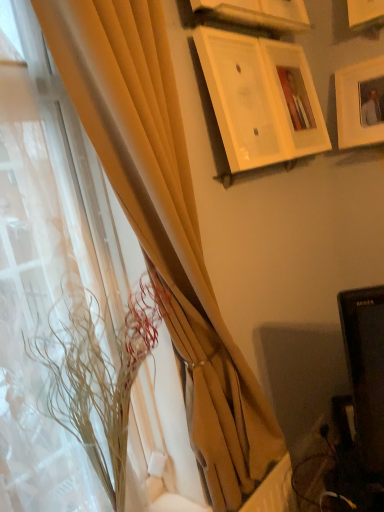
Question: Which direction should I rotate to look at wooden picture frame at upper center, the 3th picture frame in the right-to-left sequence, — up or down?

Choices:
 (A) up
 (B) down

Answer: (A)

Question: Is white matte picture frame at upper right, which is the first picture frame from right to left, to the right of matte yellow curtain at left, arranged as the first curtain when viewed from the right, from the viewer's perspective?

Choices:
 (A) yes
 (B) no

Answer: (A)

Question: Is white matte picture frame at upper right, the fourth picture frame in the left-to-right sequence, smaller than matte yellow curtain at left, the second curtain in the left-to-right sequence?

Choices:
 (A) no
 (B) yes

Answer: (B)

Question: Is white matte picture frame at upper right, which is the first picture frame from right to left, wider than matte yellow curtain at left, the second curtain in the left-to-right sequence?

Choices:
 (A) no
 (B) yes

Answer: (A)

Question: Is white matte picture frame at upper right, which is the first picture frame from right to left, to the left of matte yellow curtain at left, arranged as the first curtain when viewed from the right, from the viewer's perspective?

Choices:
 (A) no
 (B) yes

Answer: (A)

Question: Is white matte picture frame at upper right, the fourth picture frame in the left-to-right sequence, facing away from matte yellow curtain at left, the second curtain in the left-to-right sequence?

Choices:
 (A) no
 (B) yes

Answer: (A)

Question: Is white matte picture frame at upper right, the fourth picture frame in the left-to-right sequence, taller than matte yellow curtain at left, the second curtain in the left-to-right sequence?

Choices:
 (A) no
 (B) yes

Answer: (A)

Question: Is wooden picture frame at upper center, the second picture frame when ordered from left to right, to the right of wooden picture frame at upper center, which is counted as the 2th picture frame, starting from the right, from the viewer's perspective?

Choices:
 (A) yes
 (B) no

Answer: (B)

Question: Does wooden picture frame at upper center, the 3th picture frame in the right-to-left sequence, touch wooden picture frame at upper center, which is the 3th picture frame in left-to-right order?

Choices:
 (A) no
 (B) yes

Answer: (A)

Question: Considering the relative sizes of wooden picture frame at upper center, the 3th picture frame in the right-to-left sequence, and wooden picture frame at upper center, which is counted as the 2th picture frame, starting from the right, in the image provided, is wooden picture frame at upper center, the 3th picture frame in the right-to-left sequence, smaller than wooden picture frame at upper center, which is counted as the 2th picture frame, starting from the right,?

Choices:
 (A) yes
 (B) no

Answer: (A)

Question: Can you confirm if wooden picture frame at upper center, the 3th picture frame in the right-to-left sequence, is positioned to the left of wooden picture frame at upper center, which is counted as the 2th picture frame, starting from the right?

Choices:
 (A) yes
 (B) no

Answer: (A)

Question: From a real-world perspective, is wooden picture frame at upper center, the second picture frame when ordered from left to right, physically below wooden picture frame at upper center, which is the 3th picture frame in left-to-right order?

Choices:
 (A) yes
 (B) no

Answer: (B)

Question: Does wooden picture frame at upper center, the second picture frame when ordered from left to right, have a larger size compared to wooden picture frame at upper center, which is the 3th picture frame in left-to-right order?

Choices:
 (A) no
 (B) yes

Answer: (A)

Question: Is white glossy picture frame at upper center, the 4th picture frame from the right, with white matte picture frame at upper right, which is the first picture frame from right to left?

Choices:
 (A) yes
 (B) no

Answer: (B)